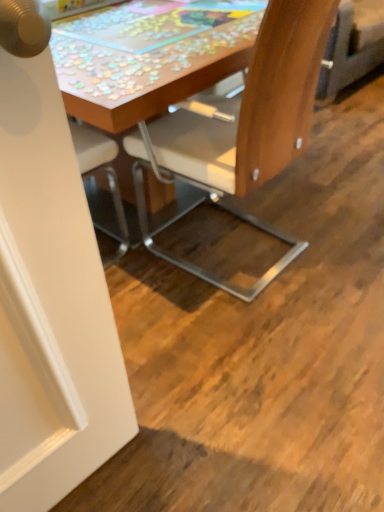
This screenshot has height=512, width=384. In order to click on vacant space in front of wooden chair at center in this screenshot , I will do `click(251, 355)`.